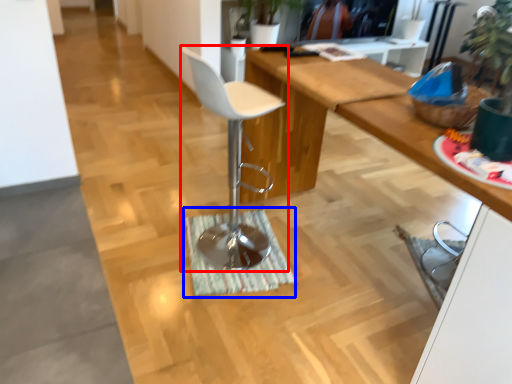
Question: Among these objects, which one is farthest to the camera, chair (highlighted by a red box) or doormat (highlighted by a blue box)?

Choices:
 (A) chair
 (B) doormat

Answer: (B)